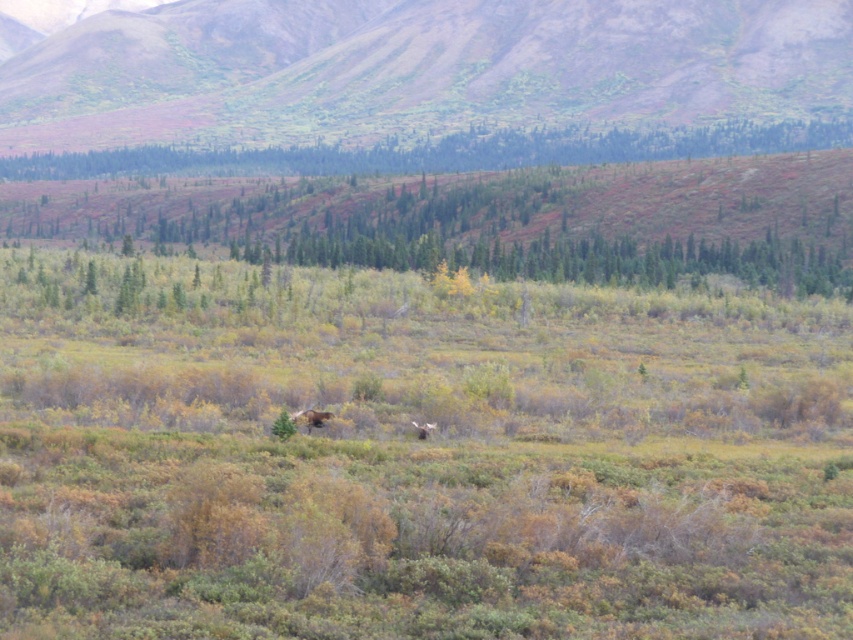
Who is lower down, green grassy hillside at upper center or brown furry bear at center?

brown furry bear at center is below.

Find the location of a particular element. The image size is (853, 640). green grassy hillside at upper center is located at coordinates (418, 68).

This screenshot has height=640, width=853. What are the coordinates of `green grassy hillside at upper center` in the screenshot? It's located at (418, 68).

Is green grassy hillside at upper center closer to camera compared to green leafy trees at upper center?

No, green grassy hillside at upper center is behind green leafy trees at upper center.

Can you confirm if green grassy hillside at upper center is positioned to the right of green leafy trees at upper center?

No, green grassy hillside at upper center is not to the right of green leafy trees at upper center.

At what (x,y) coordinates should I click in order to perform the action: click on green grassy hillside at upper center. Please return your answer as a coordinate pair (x, y). Looking at the image, I should click on (418, 68).

Find the location of a particular element. The height and width of the screenshot is (640, 853). green grassy hillside at upper center is located at coordinates (418, 68).

Which of these two, green leafy trees at upper center or brown furry bear at center, stands shorter?

With less height is brown furry bear at center.

Can you confirm if green leafy trees at upper center is smaller than brown furry bear at center?

No.

Is point (592, 147) positioned behind point (421, 424)?

That is True.

Identify the location of green leafy trees at upper center. The width and height of the screenshot is (853, 640). (442, 150).